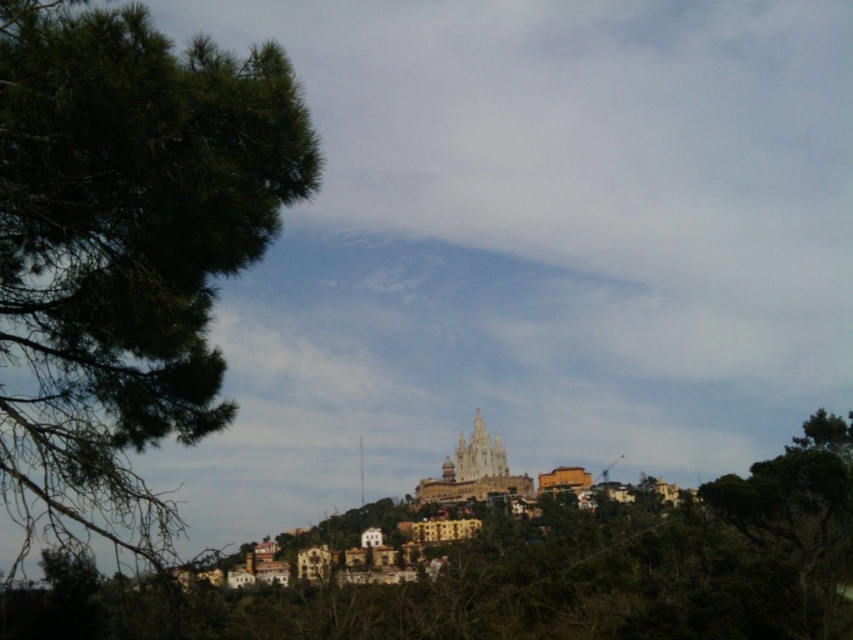
Does green leafy tree at left appear on the right side of light brown stone tower at center?

In fact, green leafy tree at left is to the left of light brown stone tower at center.

Who is more distant from viewer, (62,353) or (480,456)?

Point (480,456)

Who is more forward, (x=38, y=419) or (x=496, y=435)?

Point (x=38, y=419) is in front.

This screenshot has width=853, height=640. Identify the location of green leafy tree at left. (125, 244).

Who is more forward, (138, 120) or (460, 436)?

Point (138, 120) is in front.

Can you confirm if green leafy tree at left is thinner than golden stone tower at center?

No.

Does point (215, 176) come closer to viewer compared to point (461, 454)?

Yes, it is.

Where is `green leafy tree at left`? green leafy tree at left is located at coordinates (125, 244).

Looking at this image, between golden stone tower at center and light brown stone tower at center, which one appears on the left side from the viewer's perspective?

From the viewer's perspective, golden stone tower at center appears more on the left side.

Does golden stone tower at center have a greater height compared to light brown stone tower at center?

Yes.

Where is `golden stone tower at center`? golden stone tower at center is located at coordinates (473, 472).

Locate an element on the screen. golden stone tower at center is located at coordinates (473, 472).